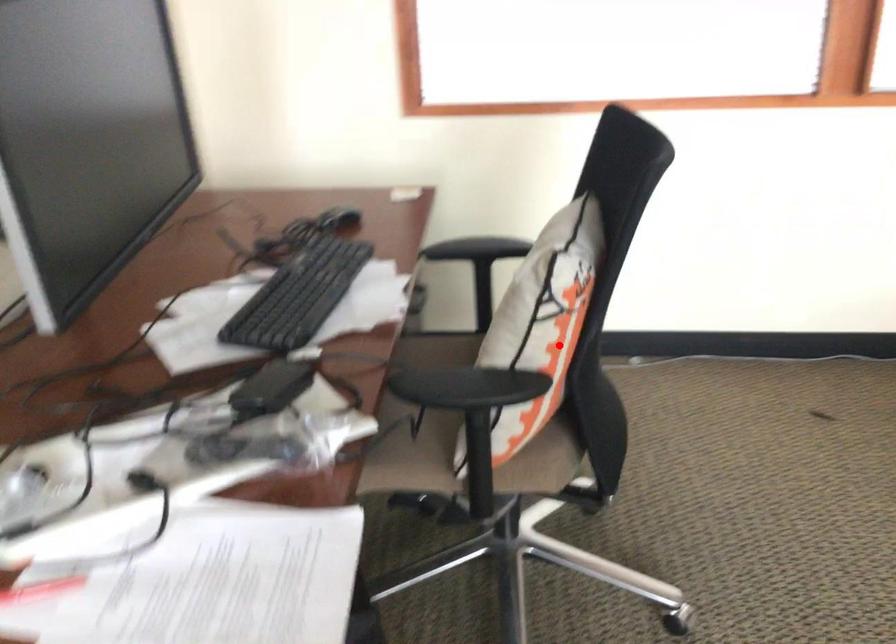
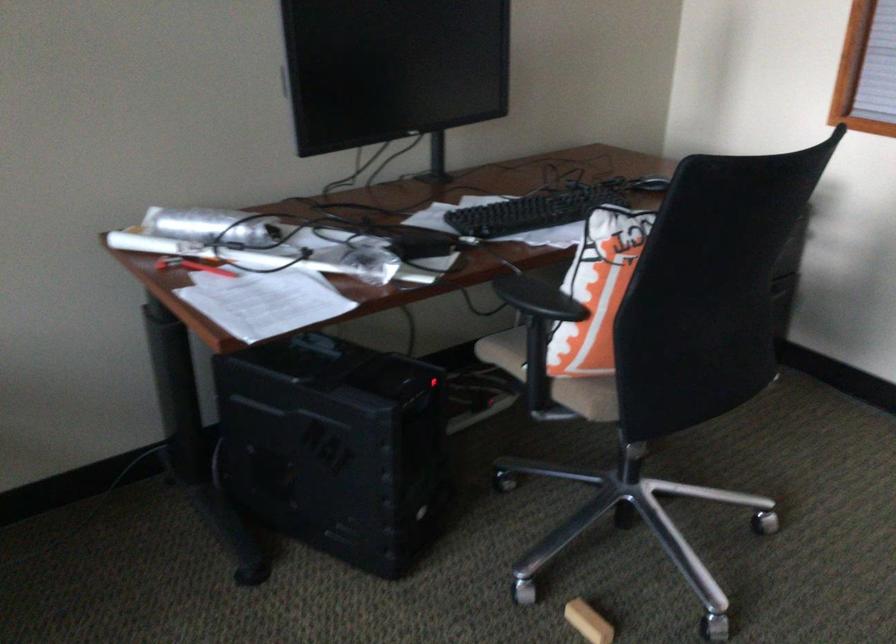
Question: I am providing you with two images of the same scene from different viewpoints. In image1, a red point is highlighted. Considering the same 3D point in image2, which of the following is correct?

Choices:
 (A) It is closer
 (B) It is farther

Answer: (B)